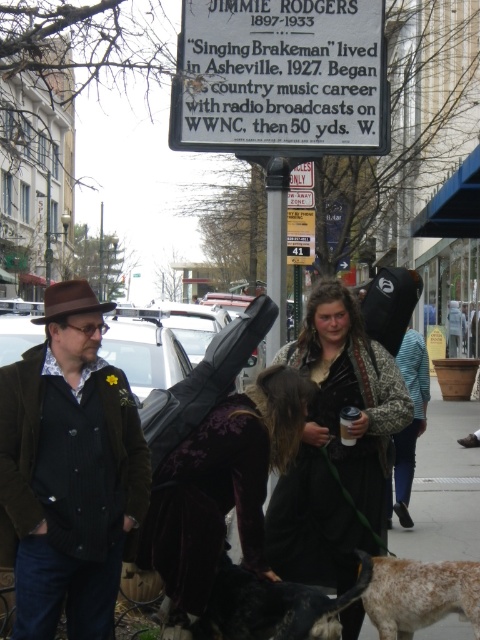
Question: Which point is farther to the camera?

Choices:
 (A) (120, 436)
 (B) (354, 518)

Answer: (B)

Question: Which object is closer to the camera taking this photo?

Choices:
 (A) camouflage jacket at center
 (B) speckled fur dog at lower right
 (C) white plastic sign at upper center
 (D) brown felt hat at center

Answer: (D)

Question: Does white plastic sign at upper center have a greater width compared to camouflage jacket at center?

Choices:
 (A) no
 (B) yes

Answer: (B)

Question: Which of the following is the farthest from the observer?

Choices:
 (A) camouflage jacket at center
 (B) white plastic sign at upper center
 (C) black fur dog at lower center
 (D) velvet purple dress at center

Answer: (B)

Question: Does white plastic sign at upper center lie in front of velvet purple dress at center?

Choices:
 (A) no
 (B) yes

Answer: (A)

Question: Is brown felt hat at center in front of black fur dog at lower center?

Choices:
 (A) no
 (B) yes

Answer: (B)